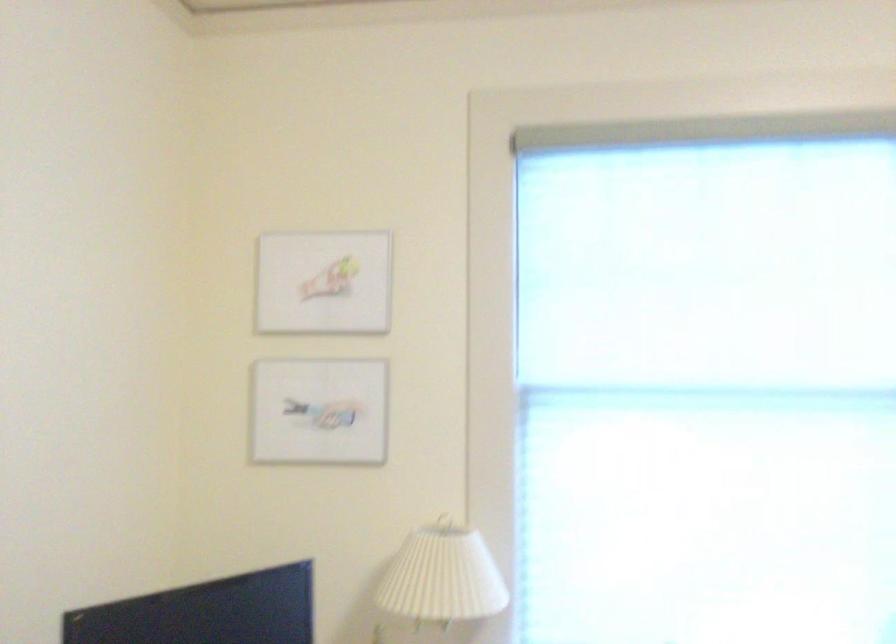
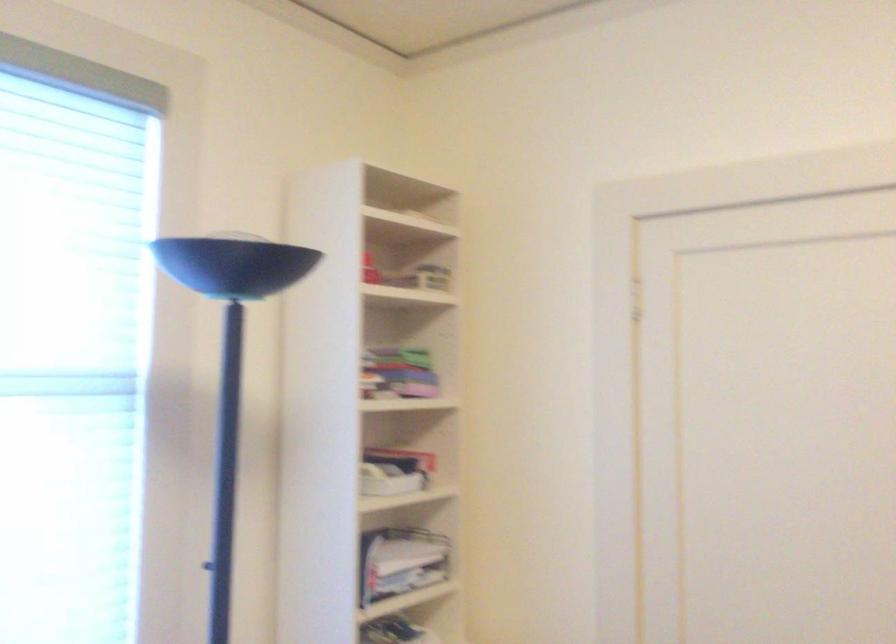
Question: The images are taken continuously from a first-person perspective. In which direction is your viewpoint rotating?

Choices:
 (A) Left
 (B) Right
 (C) Up
 (D) Down

Answer: (B)